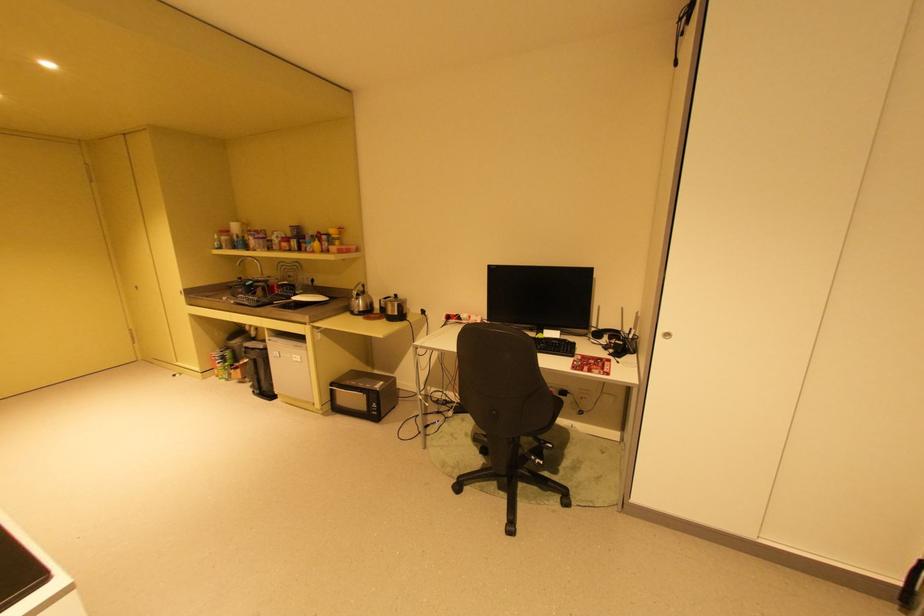
Describe the element at coordinates (666, 334) in the screenshot. I see `the sliding door handle` at that location.